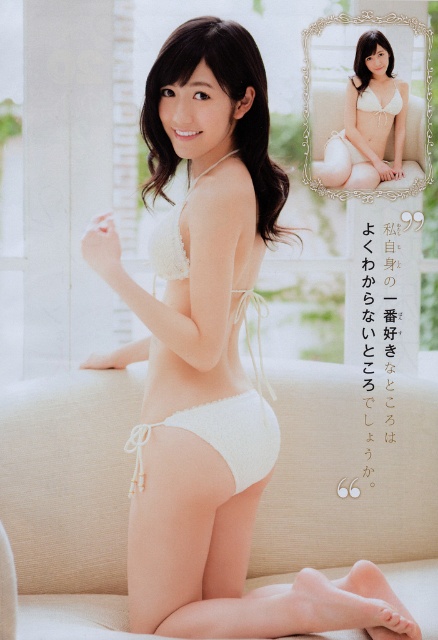
Question: Which of these objects is positioned closest to the white soft bikini at center?

Choices:
 (A) beige fabric couch at center
 (B) white soft fabric bikini bottom at lower center
 (C) white lace bikini top at upper center
 (D) white lace bra at upper right

Answer: (D)

Question: Does white soft bikini at center appear over white lace bikini top at upper center?

Choices:
 (A) no
 (B) yes

Answer: (A)

Question: Which point appears farthest from the camera in this image?

Choices:
 (A) (144, 428)
 (B) (191, 49)
 (C) (374, 112)

Answer: (C)

Question: Does beige fabric couch at center have a lesser width compared to white soft bikini at center?

Choices:
 (A) yes
 (B) no

Answer: (B)

Question: Observing the image, what is the correct spatial positioning of beige fabric couch at center in reference to white soft bikini at center?

Choices:
 (A) below
 (B) above

Answer: (A)

Question: Which of the following is the farthest from the observer?

Choices:
 (A) white lace bikini top at upper center
 (B) white crochet bikini at center
 (C) beige fabric couch at center
 (D) white soft bikini at center

Answer: (A)